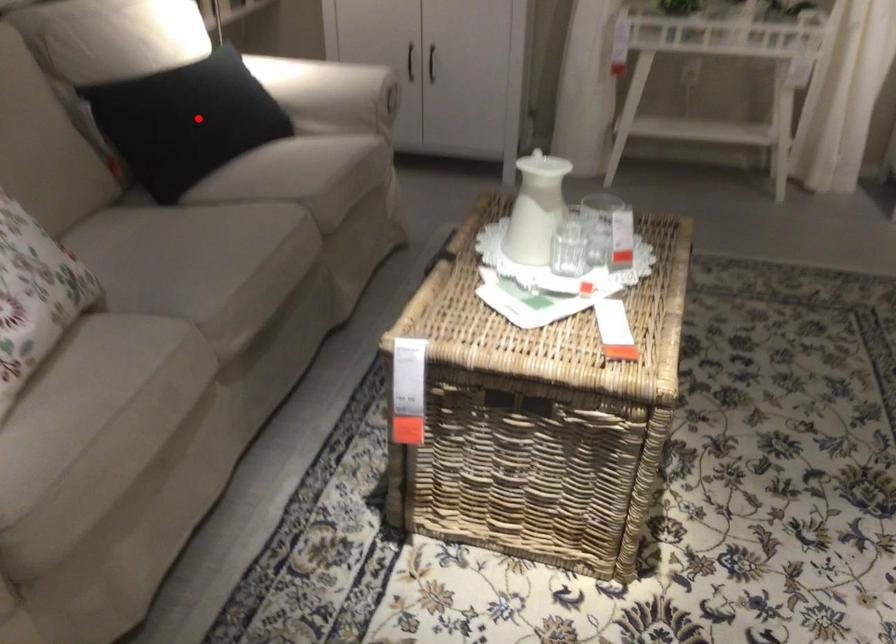
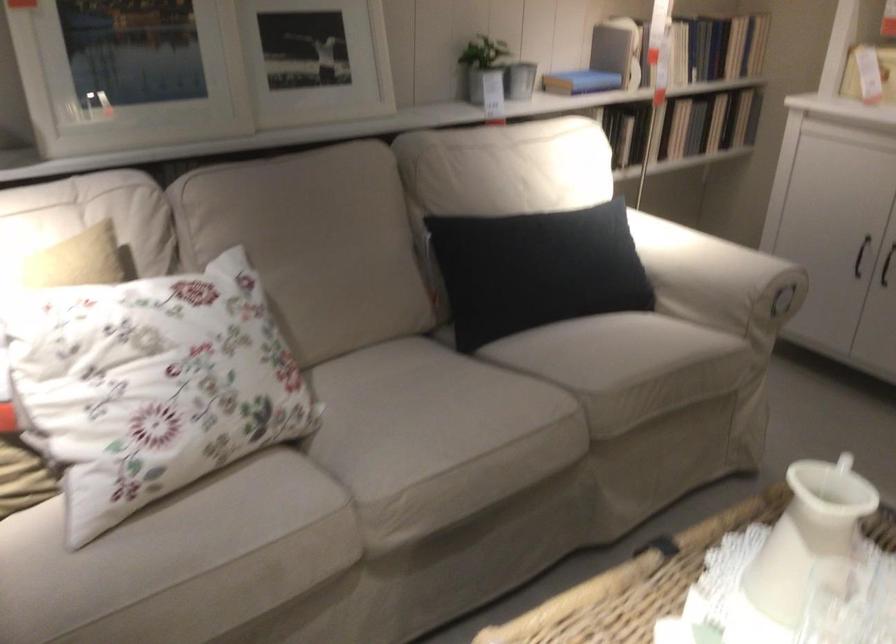
The point at the highlighted location is marked in the first image. Where is the corresponding point in the second image?

(536, 270)